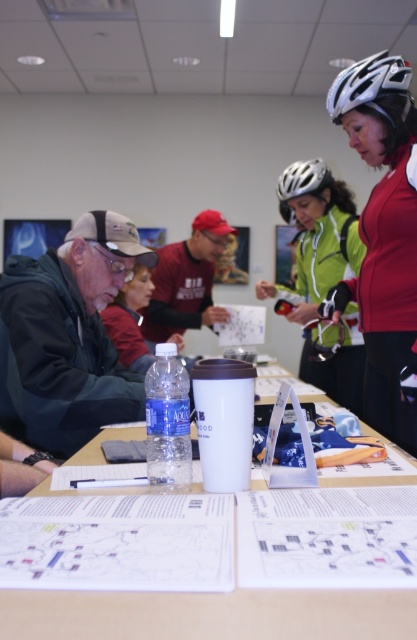
You are a person sitting at the table and want to reach for the matte black helmet at upper right. Is the silver metallic helmet at upper center blocking your path?

The matte black helmet at upper right is in front of the silver metallic helmet at upper center, so the silver metallic helmet at upper center is behind it and not blocking the path.